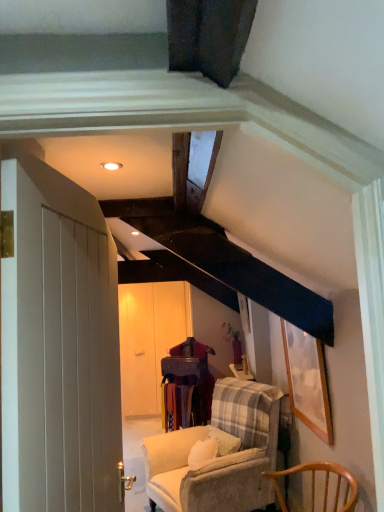
Where is `white wooden door at left`? This screenshot has height=512, width=384. white wooden door at left is located at coordinates (58, 346).

Describe the element at coordinates (314, 483) in the screenshot. I see `wooden chair at lower right, positioned as the first chair in front-to-back order` at that location.

The image size is (384, 512). Describe the element at coordinates (219, 456) in the screenshot. I see `velvet beige armchair at center, which is counted as the first chair, starting from the back` at that location.

I want to click on wooden picture frame at upper right, so click(307, 380).

You are a GUI agent. You are given a task and a screenshot of the screen. Output one action in this format:
    pyautogui.click(x=<x>, y=<y>)
    Task: Click on the white wooden door at left
    This screenshot has width=384, height=512.
    Given the screenshot: What is the action you would take?
    pyautogui.click(x=58, y=346)

From the picture: Can you confirm if matte white wardrobe at center is wider than wooden picture frame at upper right?

Yes.

Between matte white wardrobe at center and wooden picture frame at upper right, which one is positioned in front?

wooden picture frame at upper right.

From the image's perspective, between matte white wardrobe at center and wooden picture frame at upper right, which one is located above?

wooden picture frame at upper right.

How many degrees apart are the facing directions of matte white wardrobe at center and wooden picture frame at upper right?

The angle between the facing direction of matte white wardrobe at center and the facing direction of wooden picture frame at upper right is 90 degrees.

Between white wooden door at left and wooden chair at lower right, which is the second chair from back to front, which one is positioned in front?

white wooden door at left.

Can you confirm if white wooden door at left is positioned to the right of wooden chair at lower right, which is the second chair from back to front?

In fact, white wooden door at left is to the left of wooden chair at lower right, which is the second chair from back to front.

Is white wooden door at left positioned far away from wooden chair at lower right, positioned as the first chair in front-to-back order?

Indeed, white wooden door at left is not near wooden chair at lower right, positioned as the first chair in front-to-back order.

Considering the positions of point (118, 397) and point (353, 500), is point (118, 397) closer or farther from the camera than point (353, 500)?

Point (118, 397) is closer to the camera than point (353, 500).

In the scene shown: Is white wooden door at left directly adjacent to matte white wardrobe at center?

No, white wooden door at left is not beside matte white wardrobe at center.

Between white wooden door at left and matte white wardrobe at center, which one has smaller width?

white wooden door at left is thinner.

Based on the photo, is white wooden door at left aimed at matte white wardrobe at center?

No, white wooden door at left is not oriented towards matte white wardrobe at center.

Between white wooden door at left and matte white wardrobe at center, which one appears on the left side from the viewer's perspective?

Positioned to the left is matte white wardrobe at center.

Consider the image. Are wooden chair at lower right, positioned as the first chair in front-to-back order, and velvet beige armchair at center, which is counted as the first chair, starting from the back, making contact?

No, wooden chair at lower right, positioned as the first chair in front-to-back order, is not next to velvet beige armchair at center, which is counted as the first chair, starting from the back.

Is wooden chair at lower right, which is the second chair from back to front, facing towards velvet beige armchair at center, the second chair viewed from the front?

No, wooden chair at lower right, which is the second chair from back to front, is not turned towards velvet beige armchair at center, the second chair viewed from the front.

How far apart are wooden chair at lower right, which is the second chair from back to front, and velvet beige armchair at center, which is counted as the first chair, starting from the back?

wooden chair at lower right, which is the second chair from back to front, and velvet beige armchair at center, which is counted as the first chair, starting from the back, are 88.79 centimeters apart from each other.

Which object is thinner, wooden chair at lower right, positioned as the first chair in front-to-back order, or velvet beige armchair at center, the second chair viewed from the front?

wooden chair at lower right, positioned as the first chair in front-to-back order.

Considering the sizes of white wooden door at left and wooden picture frame at upper right in the image, is white wooden door at left bigger or smaller than wooden picture frame at upper right?

In the image, white wooden door at left appears to be larger than wooden picture frame at upper right.

Consider the image. In terms of height, does white wooden door at left look taller or shorter compared to wooden picture frame at upper right?

Considering their sizes, white wooden door at left has more height than wooden picture frame at upper right.

From the image's perspective, which is below, white wooden door at left or wooden picture frame at upper right?

wooden picture frame at upper right appears lower in the image.

Consider the image. From a real-world perspective, is white wooden door at left positioned above or below wooden picture frame at upper right?

white wooden door at left is above wooden picture frame at upper right.

Which object is wider, wooden table at center or velvet beige armchair at center, the second chair viewed from the front?

velvet beige armchair at center, the second chair viewed from the front, is wider.

Could you tell me if wooden table at center is facing velvet beige armchair at center, the second chair viewed from the front?

No, wooden table at center is not oriented towards velvet beige armchair at center, the second chair viewed from the front.

From the image's perspective, relative to velvet beige armchair at center, which is counted as the first chair, starting from the back, is wooden table at center above or below?

wooden table at center is above velvet beige armchair at center, which is counted as the first chair, starting from the back.

Is wooden table at center not inside velvet beige armchair at center, the second chair viewed from the front?

Yes, wooden table at center is outside of velvet beige armchair at center, the second chair viewed from the front.

The image size is (384, 512). Find the location of `glass door behind the white wooden door at left`. glass door behind the white wooden door at left is located at coordinates (149, 339).

Is matte white wardrobe at center to the right of white wooden door at left from the viewer's perspective?

No.

Are matte white wardrobe at center and white wooden door at left making contact?

No.

Is the position of matte white wardrobe at center less distant than that of white wooden door at left?

No, matte white wardrobe at center is behind white wooden door at left.

This screenshot has height=512, width=384. I want to click on picture frame located above the matte white wardrobe at center (from the image's perspective), so click(x=307, y=380).

What are the coordinates of `door that appears in front of the wooden chair at lower right, positioned as the first chair in front-to-back order` in the screenshot? It's located at (58, 346).

Based on their spatial positions, is wooden picture frame at upper right or velvet beige armchair at center, which is counted as the first chair, starting from the back, closer to wooden table at center?

velvet beige armchair at center, which is counted as the first chair, starting from the back, is positioned closer to the anchor wooden table at center.

Which object lies nearer to the anchor point matte white wardrobe at center, velvet beige armchair at center, which is counted as the first chair, starting from the back, or wooden chair at lower right, which is the second chair from back to front?

velvet beige armchair at center, which is counted as the first chair, starting from the back.

From the image, which object appears to be farther from matte white wardrobe at center, velvet beige armchair at center, the second chair viewed from the front, or white wooden door at left?

Among the two, white wooden door at left is located further to matte white wardrobe at center.

Considering their positions, is wooden chair at lower right, positioned as the first chair in front-to-back order, positioned further to wooden picture frame at upper right than matte white wardrobe at center?

The object further to wooden picture frame at upper right is matte white wardrobe at center.

Based on their spatial positions, is white wooden door at left or wooden picture frame at upper right closer to matte white wardrobe at center?

The object closer to matte white wardrobe at center is wooden picture frame at upper right.

When comparing their distances from wooden picture frame at upper right, does matte white wardrobe at center or velvet beige armchair at center, which is counted as the first chair, starting from the back, seem closer?

velvet beige armchair at center, which is counted as the first chair, starting from the back, lies closer to wooden picture frame at upper right than the other object.

Which object lies nearer to the anchor point velvet beige armchair at center, which is counted as the first chair, starting from the back, wooden picture frame at upper right or matte white wardrobe at center?

wooden picture frame at upper right is closer to velvet beige armchair at center, which is counted as the first chair, starting from the back.

Looking at the image, which one is located further to wooden picture frame at upper right, white wooden door at left or matte white wardrobe at center?

Based on the image, matte white wardrobe at center appears to be further to wooden picture frame at upper right.

Where is `table located between wooden chair at lower right, positioned as the first chair in front-to-back order, and matte white wardrobe at center in the depth direction`? The image size is (384, 512). table located between wooden chair at lower right, positioned as the first chair in front-to-back order, and matte white wardrobe at center in the depth direction is located at coordinates (184, 367).

You are a GUI agent. You are given a task and a screenshot of the screen. Output one action in this format:
    pyautogui.click(x=<x>, y=<y>)
    Task: Click on the picture frame located between wooden chair at lower right, positioned as the first chair in front-to-back order, and wooden table at center in the depth direction
    
    Given the screenshot: What is the action you would take?
    pyautogui.click(x=307, y=380)

At what (x,y) coordinates should I click in order to perform the action: click on picture frame located between white wooden door at left and velvet beige armchair at center, which is counted as the first chair, starting from the back, in the depth direction. Please return your answer as a coordinate pair (x, y). This screenshot has width=384, height=512. Looking at the image, I should click on (307, 380).

Identify the location of picture frame positioned between white wooden door at left and wooden table at center from near to far. click(307, 380).